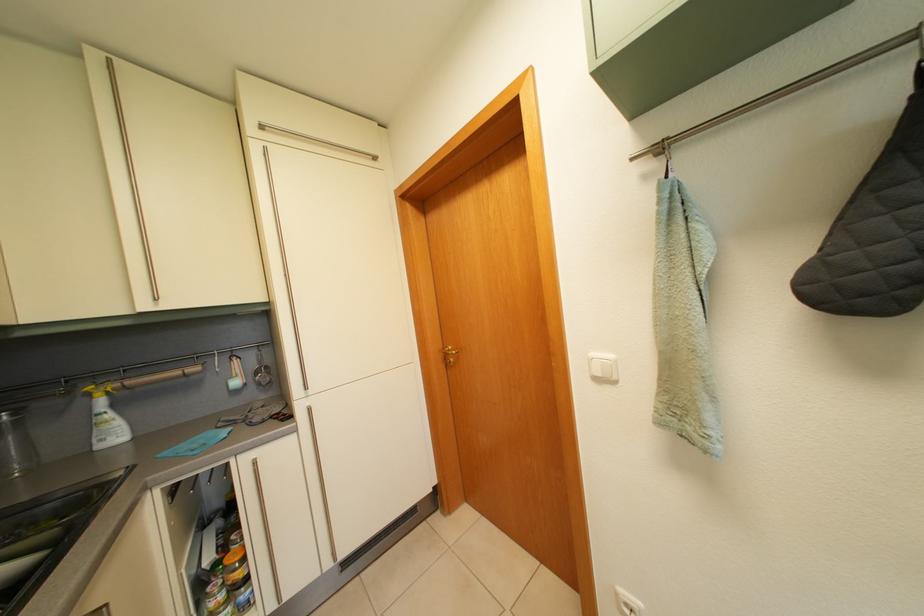
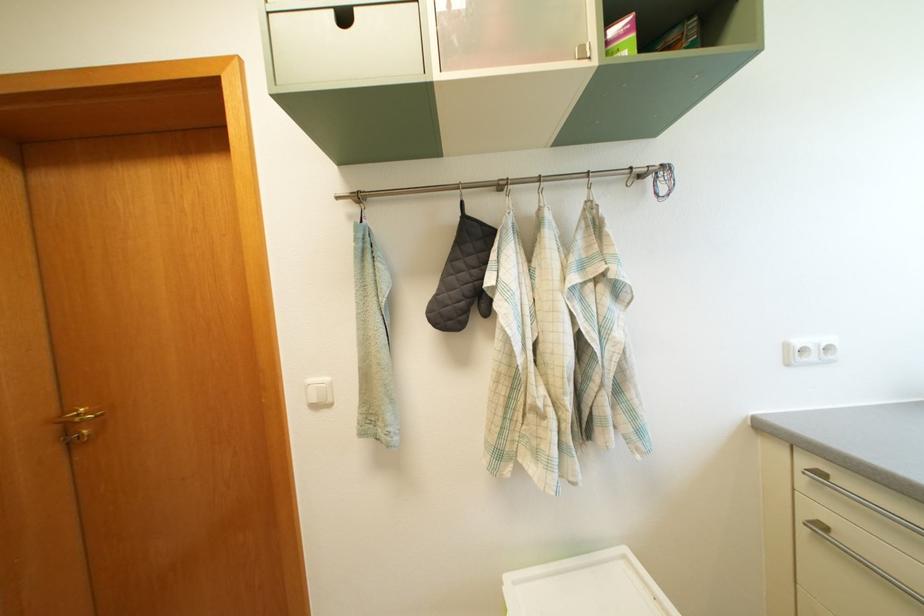
Question: The first image is from the beginning of the video and the second image is from the end. How did the camera likely rotate when shooting the video?

Choices:
 (A) Left
 (B) Right
 (C) Up
 (D) Down

Answer: (B)